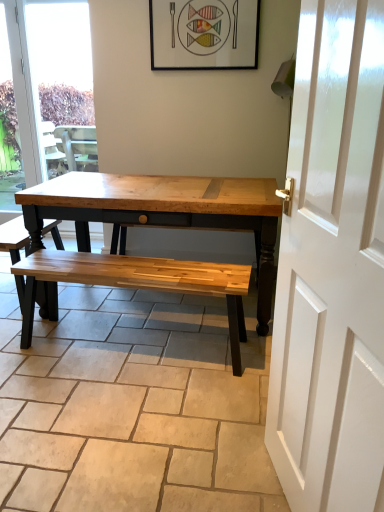
Question: Visually, is matte black picture frame at upper center positioned to the left or to the right of transparent glass window at upper left?

Choices:
 (A) left
 (B) right

Answer: (B)

Question: Is matte black picture frame at upper center situated inside transparent glass window at upper left or outside?

Choices:
 (A) inside
 (B) outside

Answer: (B)

Question: Which of these objects is positioned closest to the natural wood bench at center?

Choices:
 (A) transparent glass window at upper left
 (B) matte black picture frame at upper center
 (C) wooden bench at center

Answer: (C)

Question: Considering the real-world distances, which object is farthest from the transparent glass window at upper left?

Choices:
 (A) matte black picture frame at upper center
 (B) wooden bench at center
 (C) natural wood bench at center

Answer: (C)